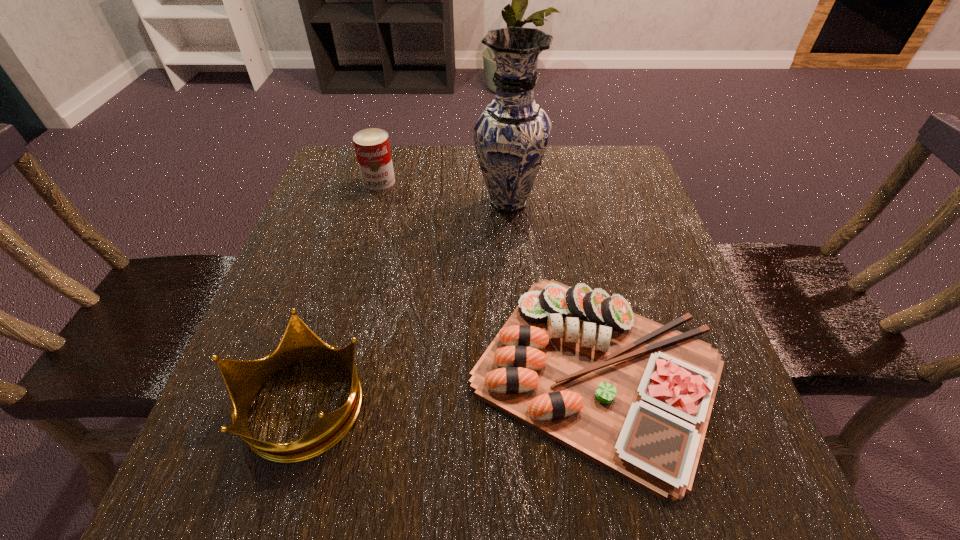
You are a GUI agent. You are given a task and a screenshot of the screen. Output one action in this format:
    pyautogui.click(x=<x>, y=<y>)
    Task: Click on the free space that satisfies the following two spatial constraints: 1. on the back side of the crown; 2. on the right side of the tallest object
    
    Given the screenshot: What is the action you would take?
    pyautogui.click(x=363, y=202)

Image resolution: width=960 pixels, height=540 pixels. I want to click on free space that satisfies the following two spatial constraints: 1. on the front label of the platter; 2. on the right side of the can, so click(325, 372).

Identify the location of vacant space that satisfies the following two spatial constraints: 1. on the front label of the platter; 2. on the right side of the can. The image size is (960, 540). (325, 372).

Locate an element on the screen. The image size is (960, 540). free space that satisfies the following two spatial constraints: 1. on the front label of the can; 2. on the left side of the vase is located at coordinates (373, 202).